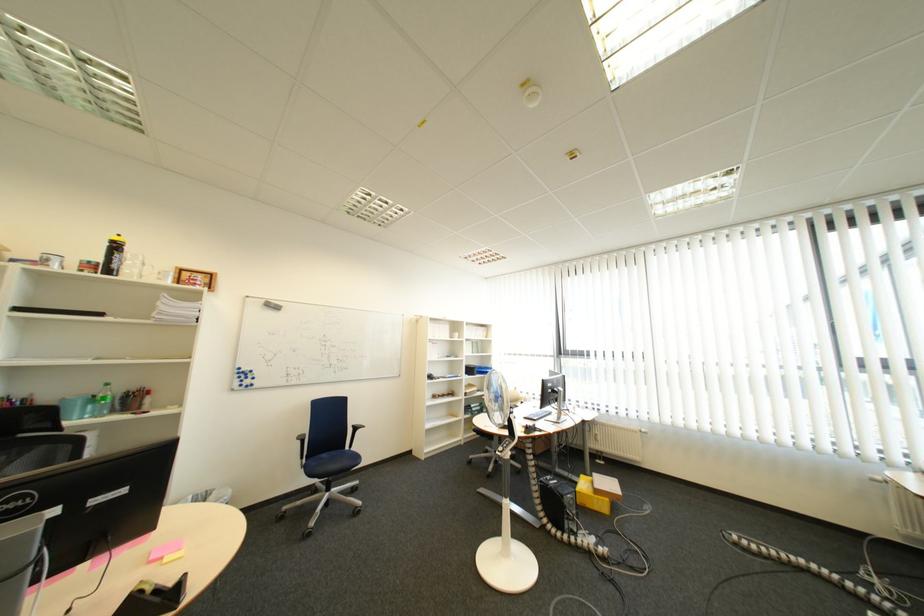
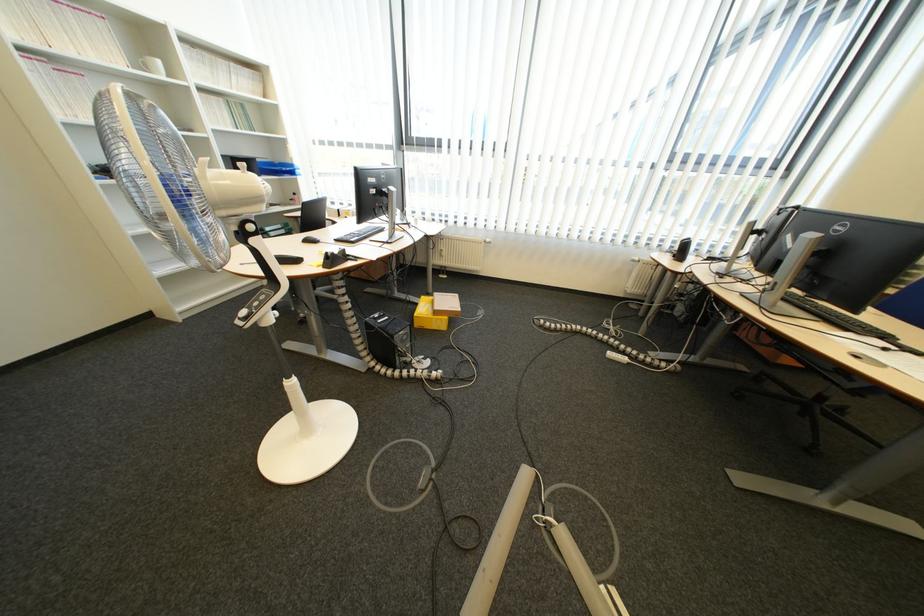
Where in the second image is the point corresponding to point (610, 440) from the first image?

(455, 257)